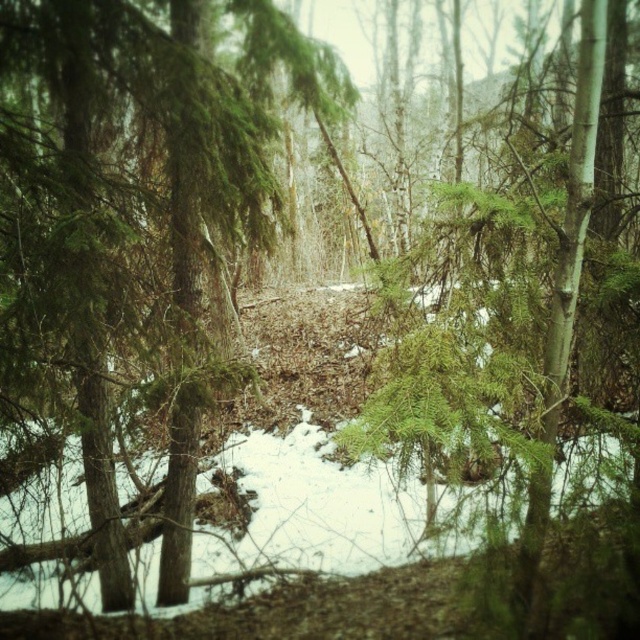
Question: Is green needle-like tree at center wider than green matte evergreen branch at center?

Choices:
 (A) yes
 (B) no

Answer: (B)

Question: Which of the following is the closest to the observer?

Choices:
 (A) (368, 440)
 (B) (193, 308)

Answer: (A)

Question: Is green needle-like tree at center to the left of green matte evergreen branch at center from the viewer's perspective?

Choices:
 (A) no
 (B) yes

Answer: (B)

Question: Can you confirm if green needle-like tree at center is wider than green matte evergreen branch at center?

Choices:
 (A) no
 (B) yes

Answer: (A)